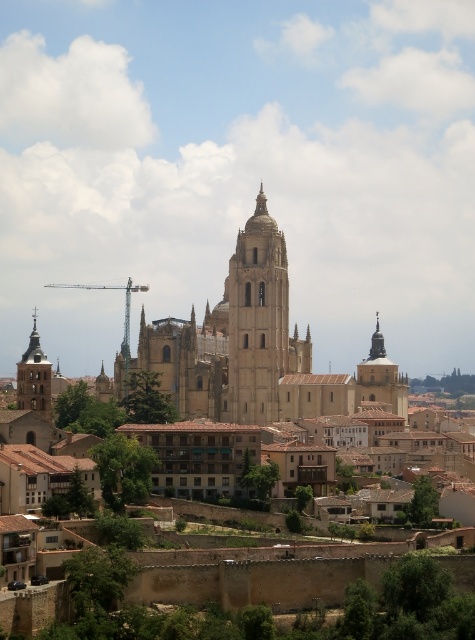
Question: Which of these objects is positioned farthest from the smooth beige tower at center?

Choices:
 (A) matte gold bell tower at left
 (B) brown stone town at center

Answer: (A)

Question: Where is brown stone town at center located in relation to matte gold bell tower at left in the image?

Choices:
 (A) above
 (B) below

Answer: (A)

Question: Does smooth stone tower at center right lie in front of matte gold bell tower at left?

Choices:
 (A) yes
 (B) no

Answer: (B)

Question: Is brown stone town at center to the right of smooth stone tower at center right from the viewer's perspective?

Choices:
 (A) no
 (B) yes

Answer: (A)

Question: Which object is farther from the camera taking this photo?

Choices:
 (A) matte gold bell tower at left
 (B) smooth stone tower at center right
 (C) smooth beige tower at center
 (D) brown stone town at center

Answer: (C)

Question: Among these points, which one is nearest to the camera?

Choices:
 (A) (332, 380)
 (B) (38, 388)
 (C) (358, 401)
 (D) (233, 326)

Answer: (B)